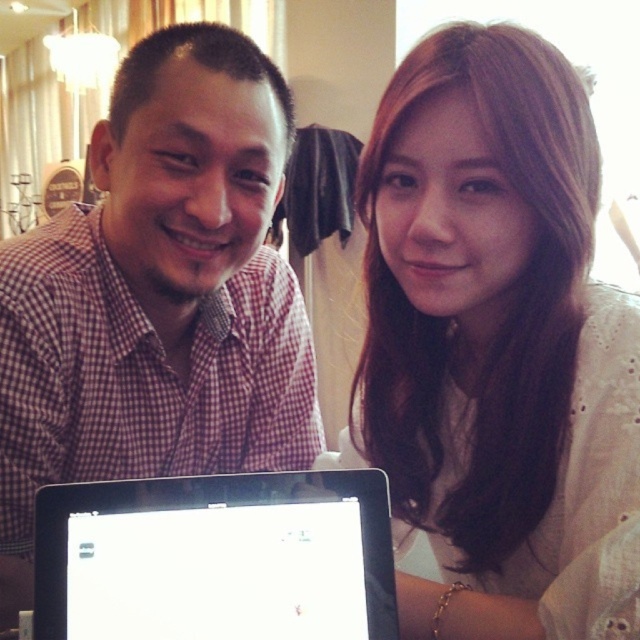
Which is behind, point (202, 225) or point (385, 602)?

Positioned behind is point (202, 225).

Is checkered fabric shirt at center further to the viewer compared to black glossy laptop at center?

Yes, checkered fabric shirt at center is further from the viewer.

At what (x,y) coordinates should I click in order to perform the action: click on checkered fabric shirt at center. Please return your answer as a coordinate pair (x, y). The height and width of the screenshot is (640, 640). Looking at the image, I should click on (157, 296).

In the scene shown: Between white lace shirt at upper right and black glossy laptop at center, which one is positioned lower?

Positioned lower is black glossy laptop at center.

Can you confirm if white lace shirt at upper right is wider than black glossy laptop at center?

No.

Locate an element on the screen. The height and width of the screenshot is (640, 640). white lace shirt at upper right is located at coordinates (497, 340).

Does white lace shirt at upper right have a greater width compared to checkered fabric shirt at center?

In fact, white lace shirt at upper right might be narrower than checkered fabric shirt at center.

Can you confirm if white lace shirt at upper right is smaller than checkered fabric shirt at center?

Yes.

The height and width of the screenshot is (640, 640). What are the coordinates of `white lace shirt at upper right` in the screenshot? It's located at (497, 340).

Find the location of `white lace shirt at upper right`. white lace shirt at upper right is located at coordinates (497, 340).